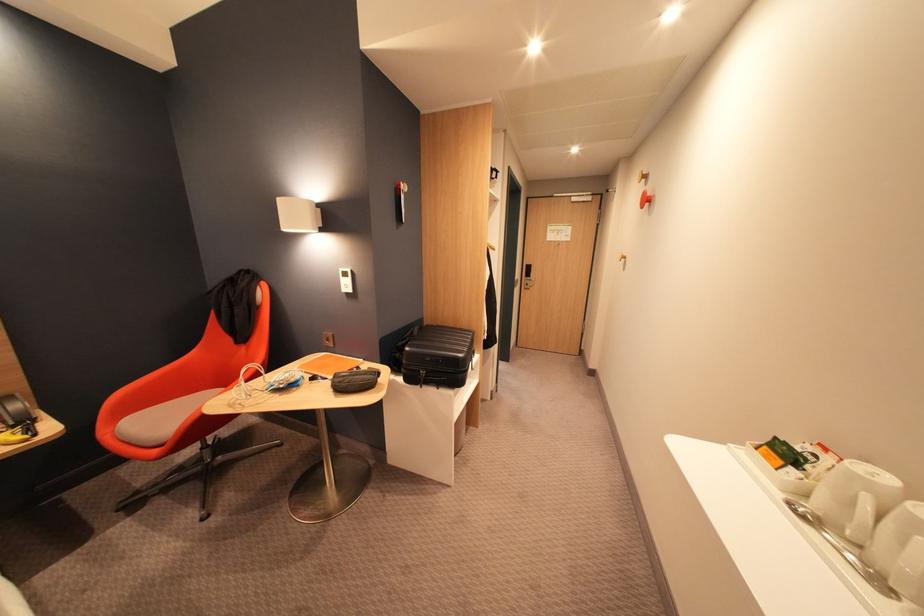
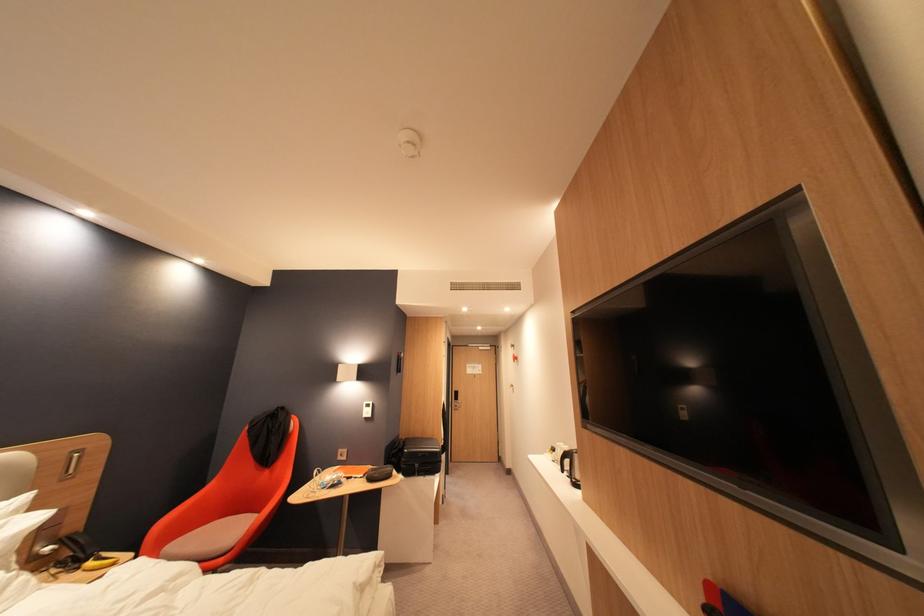
Find the pixel in the second image that matches [733,444] in the first image.

(553, 455)